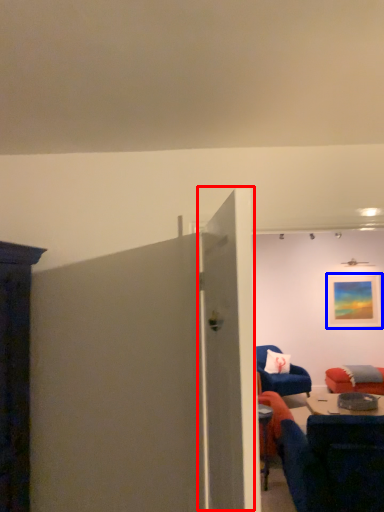
Question: Among these objects, which one is farthest to the camera, door (highlighted by a red box) or picture frame (highlighted by a blue box)?

Choices:
 (A) door
 (B) picture frame

Answer: (B)